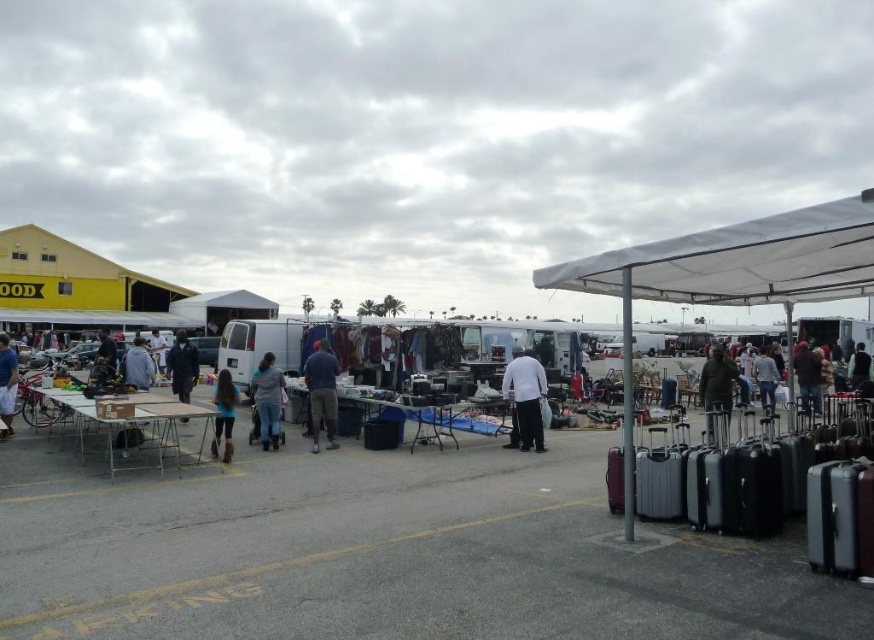
You are a customer at the flea market and want to buy a blue cotton shirt at center and a camera. If you can only carry one item at a time, which item should you pick up first to minimize the distance you have to walk?

The blue cotton shirt at center and camera are 37.50 feet apart from each other. To minimize walking distance, you should pick up the blue cotton shirt at center first, then the camera, as this requires walking 37.50 feet total. Alternatively, picking up the camera first would also require the same distance. Either order is acceptable since the total distance remains the same.

You are a customer at the flea market and want to find the tallest item between the blue cotton shirt at center and the blue denim jeans at center. Which one should you look for?

The blue cotton shirt at center is taller than the blue denim jeans at center, so you should look for the blue cotton shirt at center.